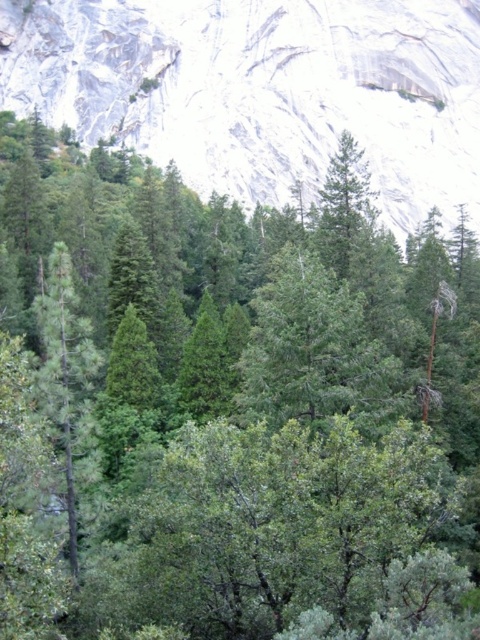
Does point (478, 20) lie behind point (55, 291)?

Yes, point (478, 20) is farther from viewer.

From the picture: Can you confirm if white rock at upper center is positioned below green matte tree at left?

No, white rock at upper center is not below green matte tree at left.

Does point (428, 132) come closer to viewer compared to point (80, 349)?

No.

At what (x,y) coordinates should I click in order to perform the action: click on white rock at upper center. Please return your answer as a coordinate pair (x, y). This screenshot has height=640, width=480. Looking at the image, I should click on (264, 90).